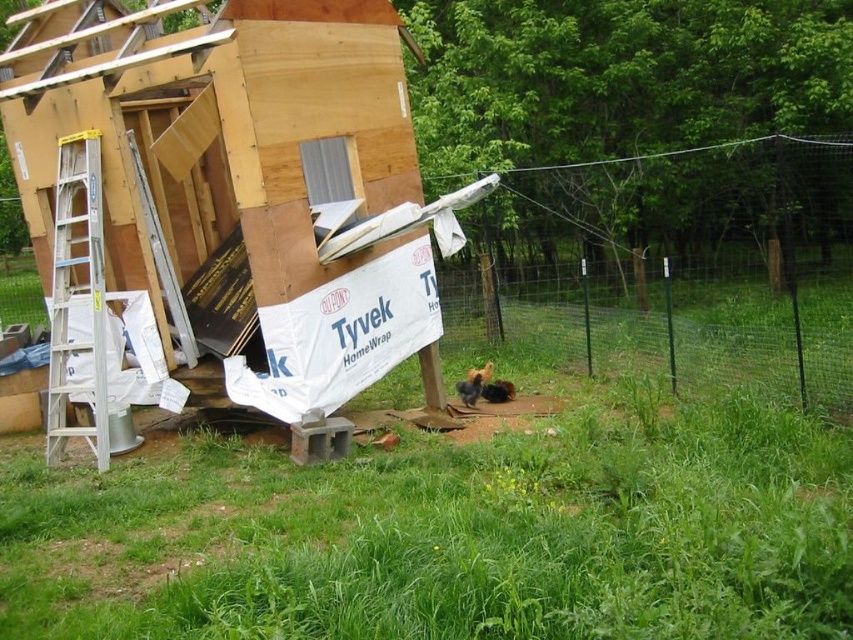
Who is higher up, green grass at lower center or wooden hut at left?

wooden hut at left is above.

In the scene shown: Does green grass at lower center appear over wooden hut at left?

Actually, green grass at lower center is below wooden hut at left.

Who is more distant from viewer, (515, 538) or (202, 252)?

Positioned behind is point (202, 252).

Identify the location of green grass at lower center. The width and height of the screenshot is (853, 640). (451, 534).

What do you see at coordinates (451, 534) in the screenshot?
I see `green grass at lower center` at bounding box center [451, 534].

The image size is (853, 640). What are the coordinates of `green grass at lower center` in the screenshot? It's located at point(451,534).

Which is above, green grass at lower center or silver/aluminum ladder at left?

silver/aluminum ladder at left is higher up.

In the scene shown: Between green grass at lower center and silver/aluminum ladder at left, which one appears on the right side from the viewer's perspective?

green grass at lower center

Describe the element at coordinates (451, 534) in the screenshot. I see `green grass at lower center` at that location.

The image size is (853, 640). In order to click on green grass at lower center in this screenshot , I will do `click(451, 534)`.